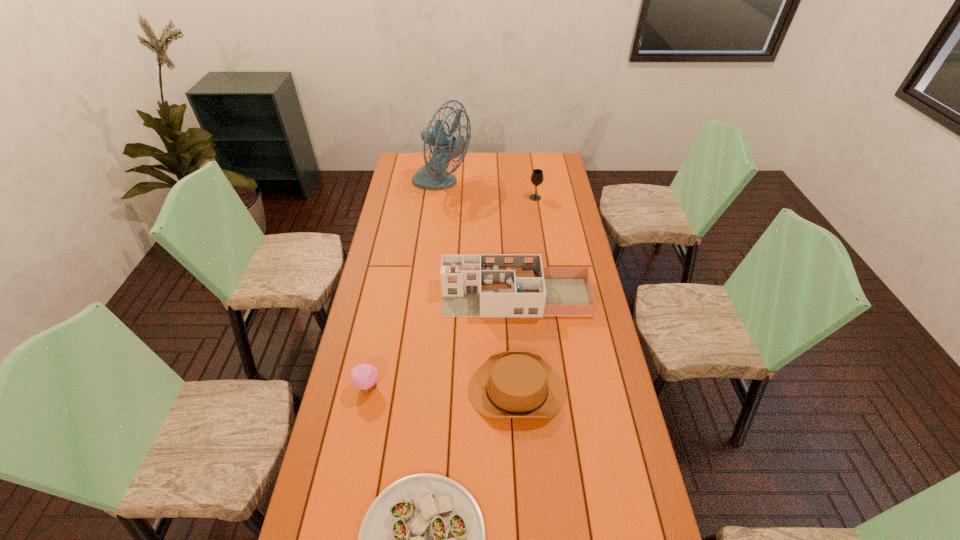
Image resolution: width=960 pixels, height=540 pixels. What are the coordinates of `vacant space located 0.100m on the back of the cupcake` in the screenshot? It's located at (375, 351).

Where is `free spot located 0.310m on the front-facing side of the cowboy hat`? Image resolution: width=960 pixels, height=540 pixels. free spot located 0.310m on the front-facing side of the cowboy hat is located at coordinates (373, 390).

The image size is (960, 540). In order to click on vacant space located on the front-facing side of the cowboy hat in this screenshot , I will do `click(346, 390)`.

Locate an element on the screen. blank space located 0.240m on the front-facing side of the cowboy hat is located at coordinates (395, 390).

This screenshot has height=540, width=960. Identify the location of object present at the far edge. (432, 176).

Image resolution: width=960 pixels, height=540 pixels. What are the coordinates of `fan at the left edge` in the screenshot? It's located at (432, 176).

I want to click on cupcake situated at the left edge, so click(x=364, y=377).

In order to click on wineglass located at the right edge in this screenshot , I will do `click(537, 177)`.

The image size is (960, 540). Find the location of `dollhouse situated at the right edge`. dollhouse situated at the right edge is located at coordinates (473, 285).

You are a GUI agent. You are given a task and a screenshot of the screen. Output one action in this format:
    pyautogui.click(x=<x>, y=<y>)
    Task: Click on the object positioned at the far left corner
    
    Given the screenshot: What is the action you would take?
    pyautogui.click(x=432, y=176)